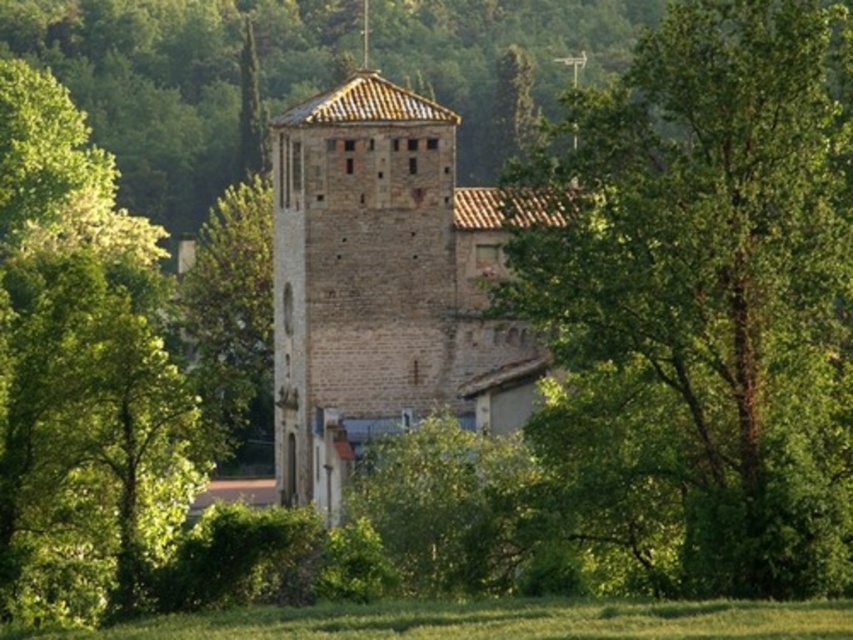
Question: Does green leafy tree at center have a lesser width compared to brown stone tower at center?

Choices:
 (A) yes
 (B) no

Answer: (A)

Question: Can you confirm if green leafy tree at center is wider than brown stone tower at center?

Choices:
 (A) yes
 (B) no

Answer: (B)

Question: Is green leafy tree at center bigger than brown stone tower at center?

Choices:
 (A) yes
 (B) no

Answer: (A)